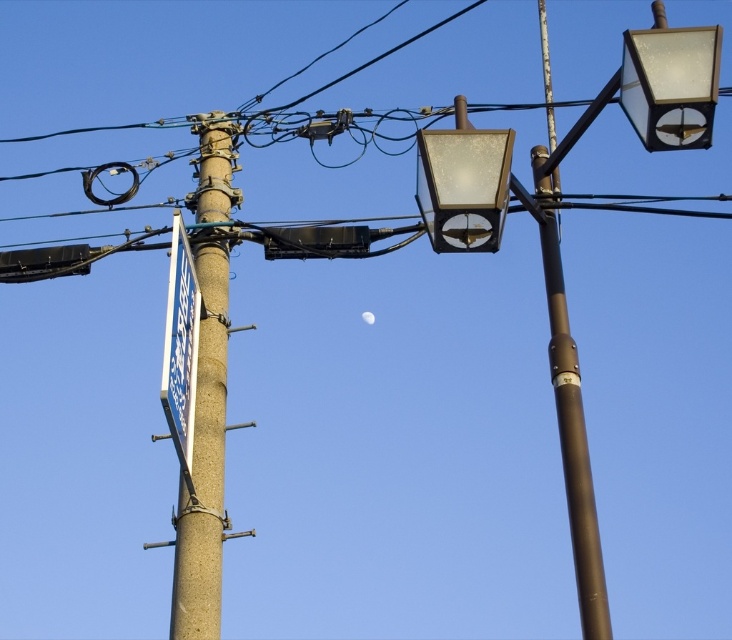
Which of these two, brown metallic pole at upper right or blue plastic sign at left, stands taller?

brown metallic pole at upper right is taller.

Describe the element at coordinates (569, 417) in the screenshot. I see `brown metallic pole at upper right` at that location.

Identify the location of brown metallic pole at upper right. The height and width of the screenshot is (640, 732). (569, 417).

Is matte brown street light at upper right below matte glass streetlight at upper center?

Incorrect, matte brown street light at upper right is not positioned below matte glass streetlight at upper center.

Does matte brown street light at upper right have a lesser height compared to matte glass streetlight at upper center?

In fact, matte brown street light at upper right may be taller than matte glass streetlight at upper center.

The width and height of the screenshot is (732, 640). What do you see at coordinates (653, 92) in the screenshot?
I see `matte brown street light at upper right` at bounding box center [653, 92].

I want to click on matte brown street light at upper right, so click(653, 92).

Between point (190, 509) and point (649, 122), which one is positioned behind?

The point (190, 509) is more distant.

Does concrete textured telegraph pole at left have a greater width compared to translucent glass streetlight at upper right?

Yes.

Is point (195, 605) positioned after point (706, 58)?

Yes, it is behind point (706, 58).

At what (x,y) coordinates should I click in order to perform the action: click on concrete textured telegraph pole at left. Please return your answer as a coordinate pair (x, y). Looking at the image, I should click on (203, 458).